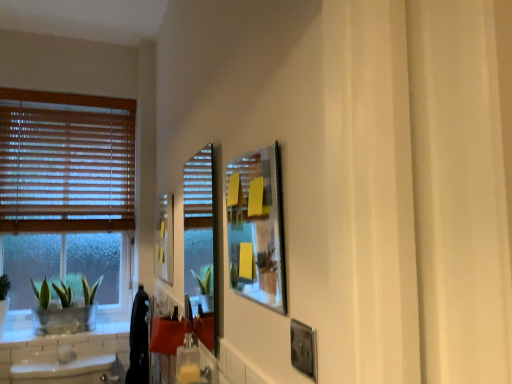
Question: Considering the relative positions of metallic silver picture frame at upper center, the second picture frame when ordered from left to right, and clear glass screen door at center in the image provided, is metallic silver picture frame at upper center, the second picture frame when ordered from left to right, to the right of clear glass screen door at center from the viewer's perspective?

Choices:
 (A) no
 (B) yes

Answer: (B)

Question: Is metallic silver picture frame at upper center, acting as the second picture frame starting from the back, wider than clear glass screen door at center?

Choices:
 (A) yes
 (B) no

Answer: (A)

Question: Is clear glass screen door at center at the back of metallic silver picture frame at upper center, the second picture frame when ordered from left to right?

Choices:
 (A) no
 (B) yes

Answer: (A)

Question: Is metallic silver picture frame at upper center, acting as the second picture frame starting from the back, bigger than clear glass screen door at center?

Choices:
 (A) no
 (B) yes

Answer: (B)

Question: Could you tell me if metallic silver picture frame at upper center, placed as the second picture frame when sorted from right to left, is turned towards clear glass screen door at center?

Choices:
 (A) no
 (B) yes

Answer: (A)

Question: From the image's perspective, is metallic silver picture frame at upper center, placed as the second picture frame when sorted from right to left, below clear glass screen door at center?

Choices:
 (A) no
 (B) yes

Answer: (A)

Question: Does metallic silver picture frame at lower right, which is the third picture frame from left to right, have a smaller size compared to matte yellow picture frame at upper left, arranged as the first picture frame when viewed from the left?

Choices:
 (A) yes
 (B) no

Answer: (A)

Question: Would you say metallic silver picture frame at lower right, placed as the 1th picture frame when sorted from front to back, is outside matte yellow picture frame at upper left, acting as the 1th picture frame starting from the back?

Choices:
 (A) yes
 (B) no

Answer: (A)

Question: Does metallic silver picture frame at lower right, placed as the 1th picture frame when sorted from front to back, turn towards matte yellow picture frame at upper left, acting as the 1th picture frame starting from the back?

Choices:
 (A) yes
 (B) no

Answer: (B)

Question: Does metallic silver picture frame at lower right, placed as the 1th picture frame when sorted from front to back, have a larger size compared to matte yellow picture frame at upper left, acting as the 1th picture frame starting from the back?

Choices:
 (A) yes
 (B) no

Answer: (B)

Question: From the image's perspective, is metallic silver picture frame at lower right, the 3th picture frame viewed from the back, over matte yellow picture frame at upper left, acting as the 1th picture frame starting from the back?

Choices:
 (A) no
 (B) yes

Answer: (A)

Question: Does metallic silver picture frame at lower right, the 1th picture frame from the right, appear on the left side of matte yellow picture frame at upper left, acting as the 1th picture frame starting from the back?

Choices:
 (A) yes
 (B) no

Answer: (B)

Question: From the image's perspective, is clear glass screen door at center over metallic silver picture frame at lower right, which is the third picture frame from left to right?

Choices:
 (A) no
 (B) yes

Answer: (B)